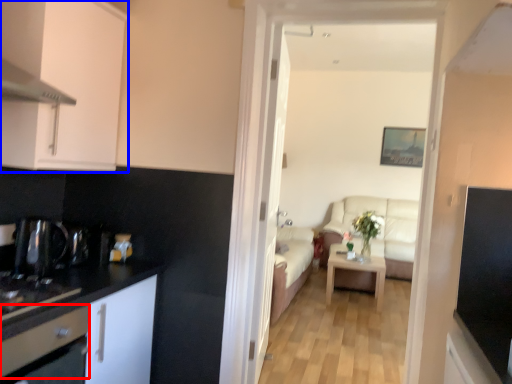
Question: Among these objects, which one is nearest to the camera, drawer (highlighted by a red box) or cabinetry (highlighted by a blue box)?

Choices:
 (A) drawer
 (B) cabinetry

Answer: (A)